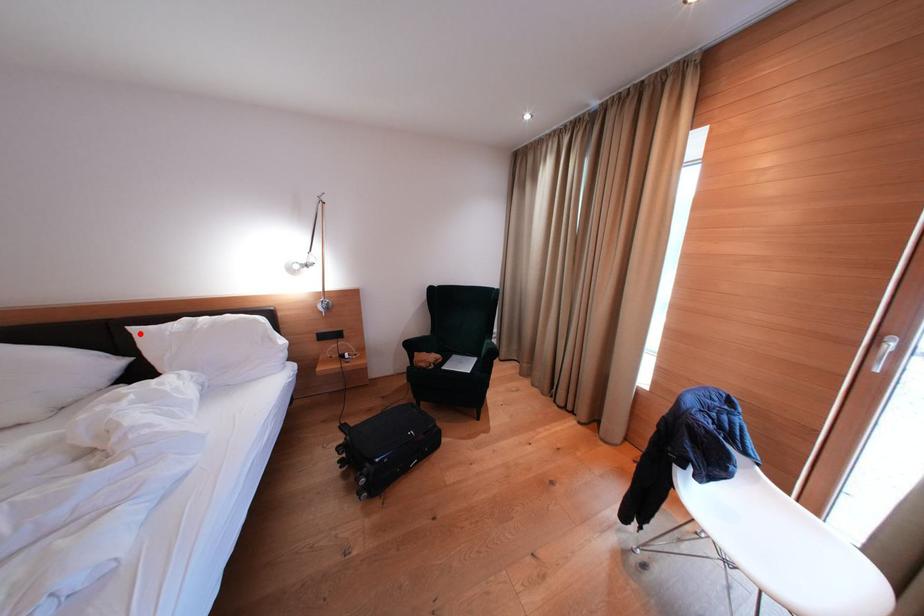
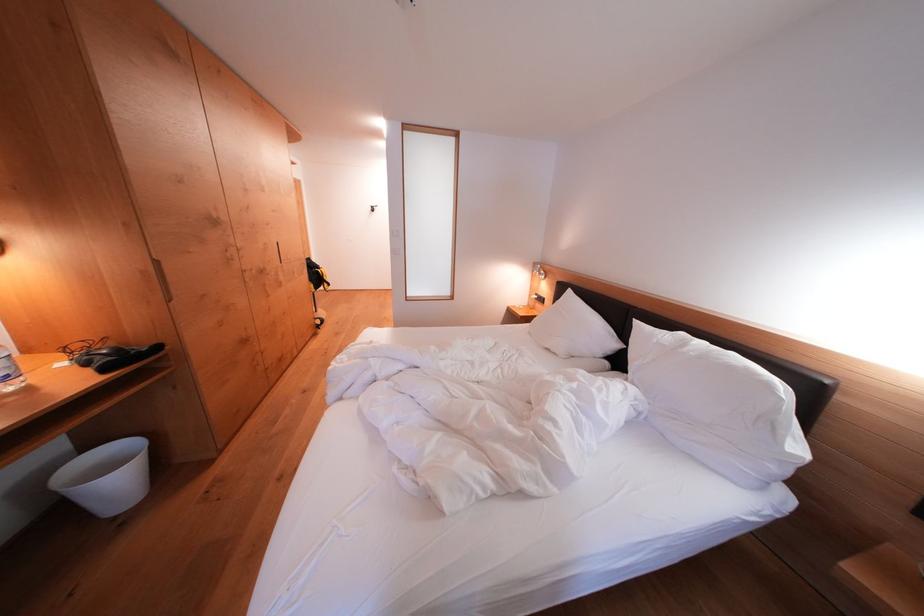
Question: A red point is marked in image1. In image2, is the corresponding 3D point closer to the camera or farther? Reply with the corresponding letter.

Choices:
 (A) The corresponding 3D point is closer.
 (B) The corresponding 3D point is farther.

Answer: (A)